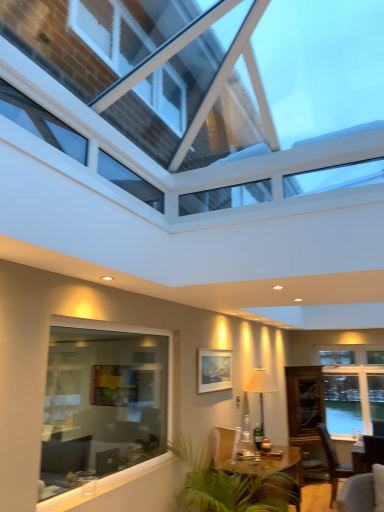
Question: Considering the positions of brown wooden chair at lower right and transparent glass roof at upper center, the 1th window when ordered from front to back, in the image, is brown wooden chair at lower right wider or thinner than transparent glass roof at upper center, the 1th window when ordered from front to back,?

Choices:
 (A) wide
 (B) thin

Answer: (B)

Question: Is point (350, 474) closer or farther from the camera than point (246, 46)?

Choices:
 (A) closer
 (B) farther

Answer: (B)

Question: Which of these objects is positioned farthest from the brown wooden chair at lower right?

Choices:
 (A) wooden armchair at center
 (B) transparent glass roof at upper center, the 3th window from the back
 (C) matte white lamp at center
 (D) wooden table at center
 (E) transparent glass cabinet at right

Answer: (B)

Question: Estimate the real-world distances between objects in this image. Which object is closer to the wooden table at center?

Choices:
 (A) white glass window at right, the first window in the back-to-front sequence
 (B) wooden armchair at center
 (C) brown wooden chair at lower right
 (D) transparent glass cabinet at right
 (E) matte white lamp at center

Answer: (B)